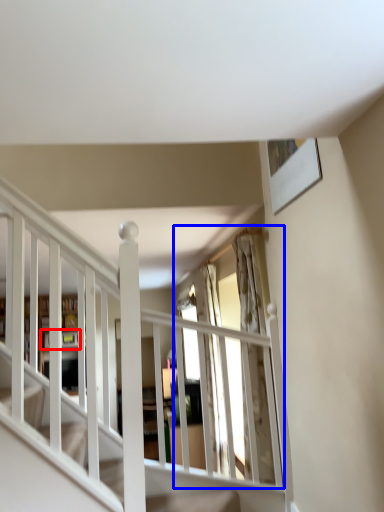
Question: Which point is closer to the camera, shelf (highlighted by a red box) or window (highlighted by a blue box)?

Choices:
 (A) shelf
 (B) window

Answer: (B)